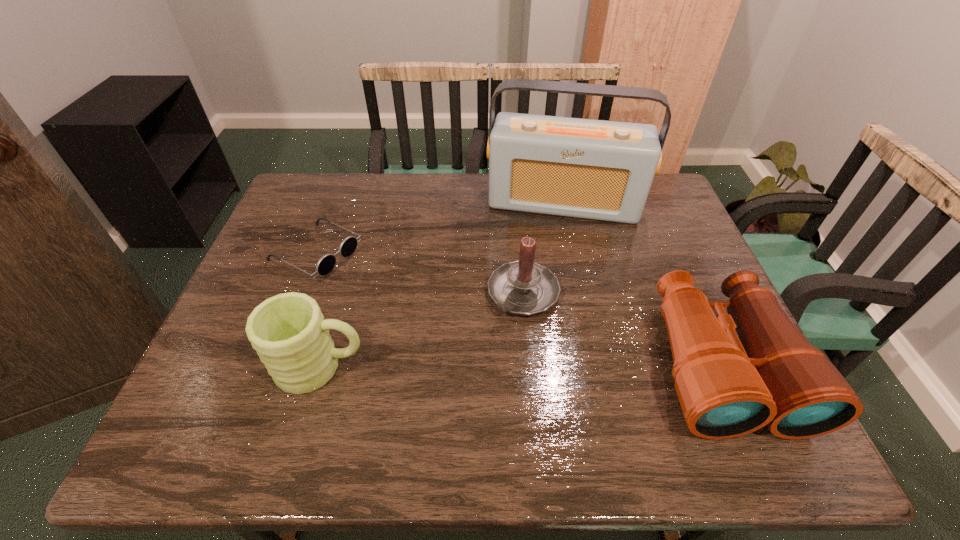
Image resolution: width=960 pixels, height=540 pixels. In order to click on empty space that is in between the candle and the tallest object in this screenshot , I will do `click(543, 248)`.

The image size is (960, 540). What are the coordinates of `vacant area that lies between the radio receiver and the shortest object` in the screenshot? It's located at (440, 228).

In order to click on vacant space in between the radio receiver and the binoculars in this screenshot , I will do `click(642, 284)`.

Locate an element on the screen. vacant region between the binoculars and the candle is located at coordinates (622, 329).

Where is `free space between the tallest object and the binoculars`? This screenshot has width=960, height=540. free space between the tallest object and the binoculars is located at coordinates (642, 284).

This screenshot has width=960, height=540. What are the coordinates of `vacant area that lies between the candle and the binoculars` in the screenshot? It's located at (622, 329).

Where is `empty location between the shortest object and the candle`? Image resolution: width=960 pixels, height=540 pixels. empty location between the shortest object and the candle is located at coordinates (420, 273).

Point out which object is positioned as the nearest to the candle. Please provide its 2D coordinates. Your answer should be formatted as a tuple, i.e. [(x, y)], where the tuple contains the x and y coordinates of a point satisfying the conditions above.

[(602, 170)]

Locate an element on the screen. Image resolution: width=960 pixels, height=540 pixels. the third closest object to the candle is located at coordinates [x=288, y=331].